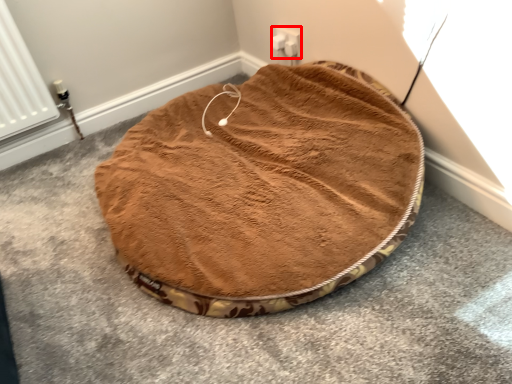
Question: From the image's perspective, what is the correct spatial relationship of electric outlet (annotated by the red box) in relation to dog bed?

Choices:
 (A) below
 (B) above

Answer: (B)